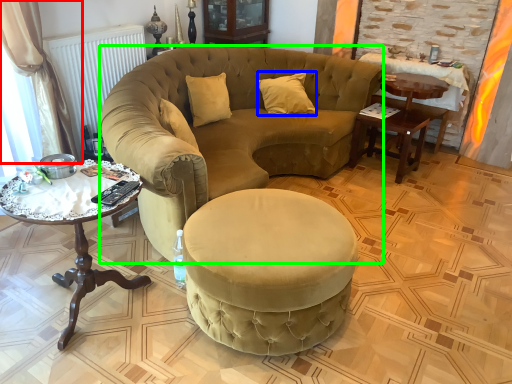
Question: Based on their relative distances, which object is farther from curtain (highlighted by a red box)? Choose from pillow (highlighted by a blue box) and chair (highlighted by a green box).

Choices:
 (A) pillow
 (B) chair

Answer: (A)